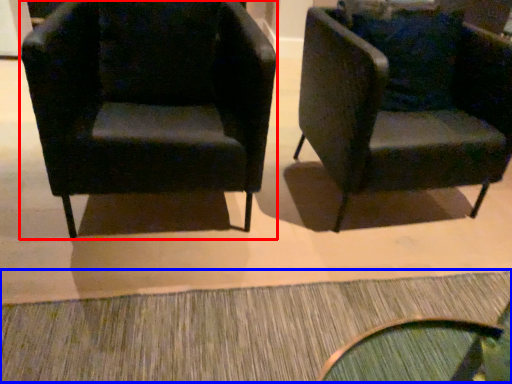
Question: Which object appears farthest to the camera in this image, chair (highlighted by a red box) or doormat (highlighted by a blue box)?

Choices:
 (A) chair
 (B) doormat

Answer: (A)